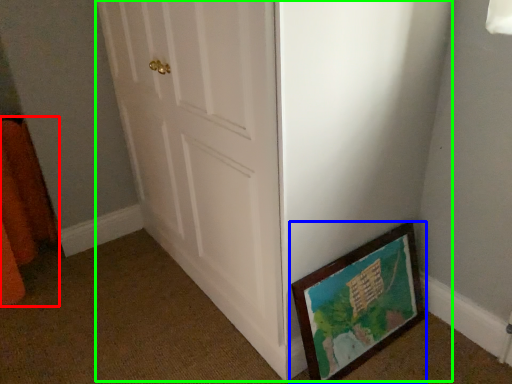
Question: Considering the real-world distances, which object is closest to curtain (highlighted by a red box)? picture frame (highlighted by a blue box) or door (highlighted by a green box).

Choices:
 (A) picture frame
 (B) door

Answer: (B)